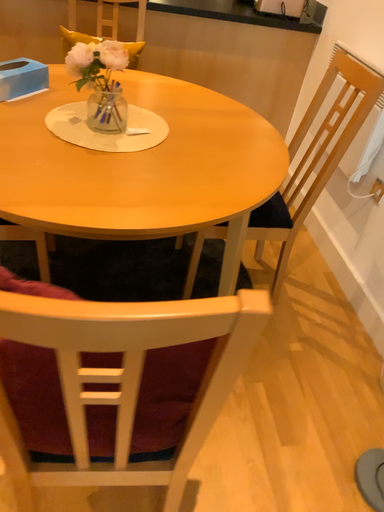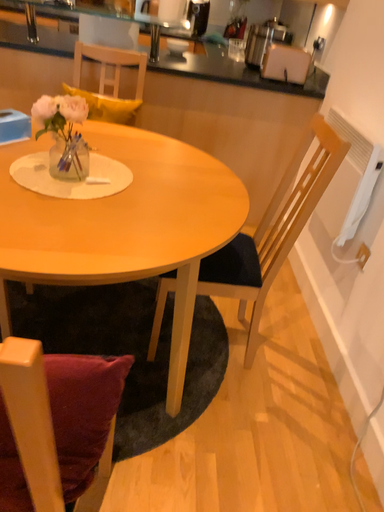
Question: How did the camera likely rotate when shooting the video?

Choices:
 (A) rotated upward
 (B) rotated downward

Answer: (A)